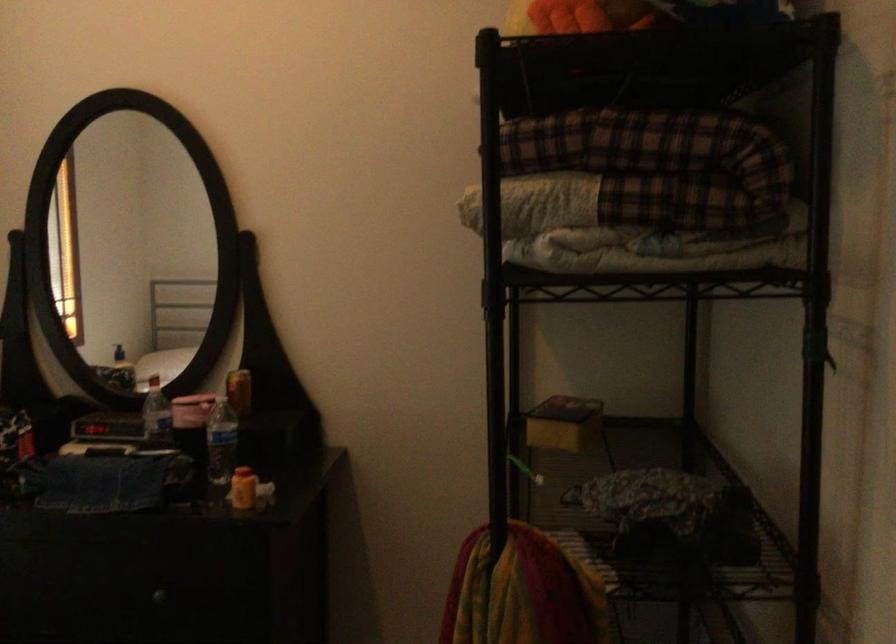
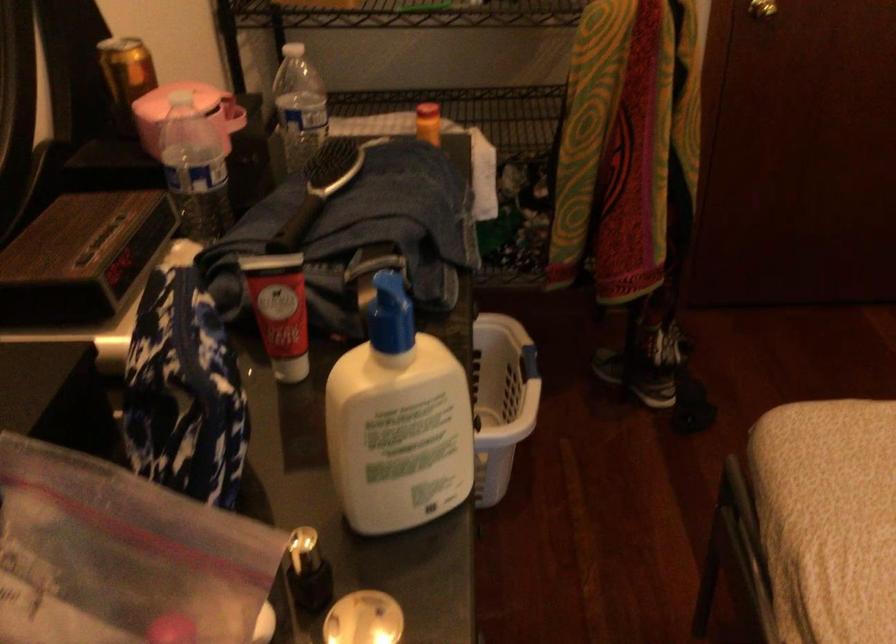
In the second image, find the point that corresponds to (234,384) in the first image.

(125, 76)